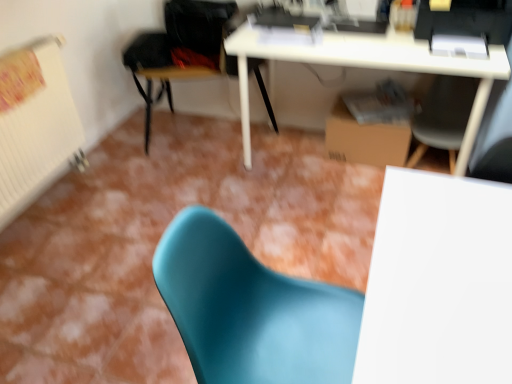
The width and height of the screenshot is (512, 384). What are the coordinates of `free spot below black leather chair at center, arranged as the third chair when viewed from the front (from a real-world perspective)` in the screenshot? It's located at (210, 140).